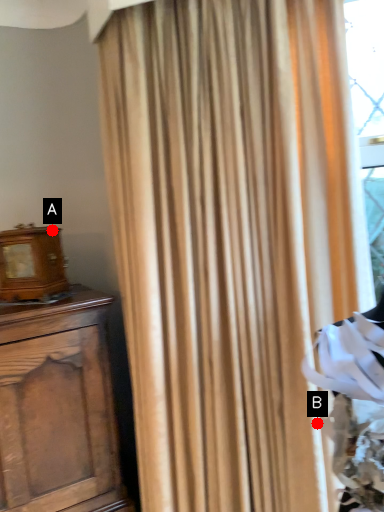
Question: Two points are circled on the image, labeled by A and B beside each circle. Which point is closer to the camera taking this photo?

Choices:
 (A) A is closer
 (B) B is closer

Answer: (B)